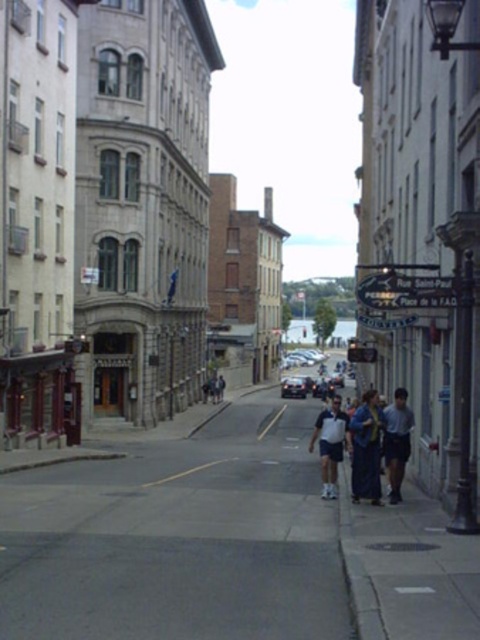
You are a fashion designer observing a street scene in a European city. You notice a blue fabric coat at center and a white cotton shirt at center. Which clothing item is shorter in height?

The blue fabric coat at center is shorter in height compared to the white cotton shirt at center.

You are a tourist in a European city and you see the white cotton shirt at center in the middle of the street. You want to take a photo of the shirt but need to ensure you are standing on the correct side of the street to get the best angle. Based on the street layout described, which side of the street should you stand on to capture the shirt from the front?

The white cotton shirt at center is located at point coordinates (331, 444), which places it centrally in the street. To capture it from the front, you should stand on the side opposite to the buildings with less ornate facades, which is the right side of the street, as the shirt is positioned centrally and the buildings on the left are more ornate, possibly blocking the view.